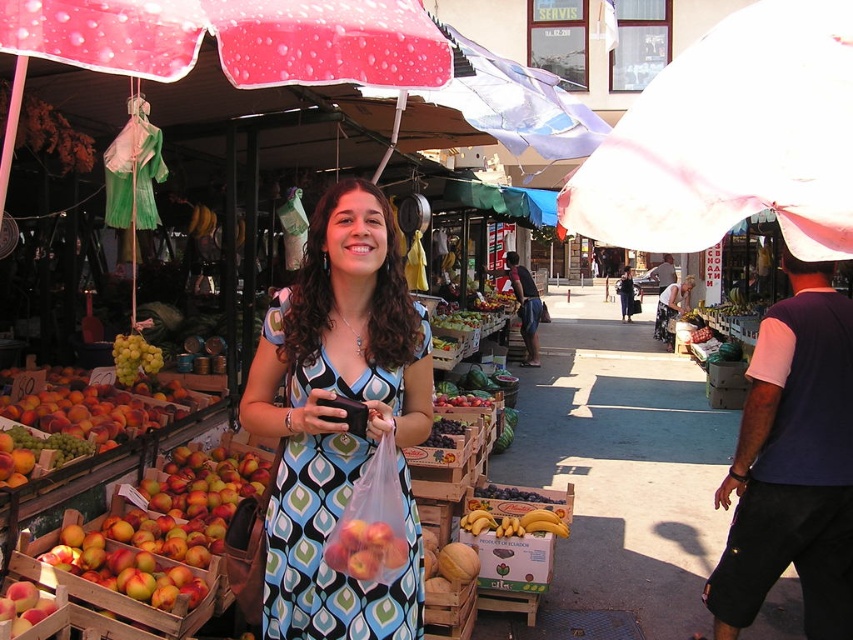
You are a photographer trying to capture the woman in the matte blue dress at center and the shiny red apples at center in the same frame. Which object should you focus on first if you want to ensure both are in focus?

The matte blue dress at center is larger in size than the shiny red apples at center, so you should focus on the larger object first to ensure both are in focus.

You are a customer at the market and want to buy the shiny red apples at center. There is a pink fabric umbrella at upper right nearby. Which object is taller?

The pink fabric umbrella at upper right is much taller than the shiny red apples at center.

You are a photographer trying to capture the woman in the matte blue dress at center without any obstructions. The shiny red apples at center are in your way. Can you adjust your position to take the photo without moving the apples?

The shiny red apples at center are behind the matte blue dress at center, so you can take the photo from the front of the matte blue dress at center without any obstruction from the apples.